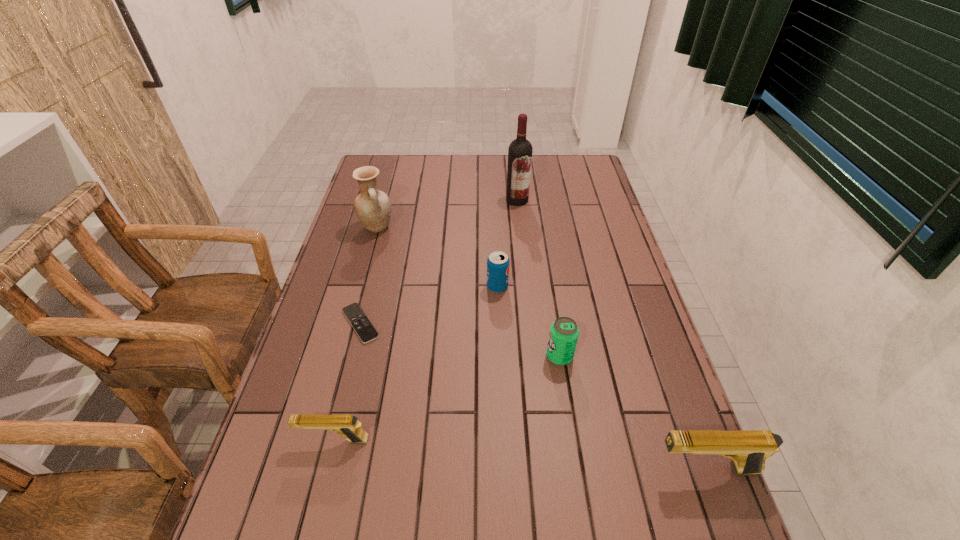
The image size is (960, 540). I want to click on object present at the near right corner, so pyautogui.click(x=749, y=449).

Where is `blank space at the far edge of the desktop`? The width and height of the screenshot is (960, 540). blank space at the far edge of the desktop is located at coordinates (544, 154).

I want to click on free space at the near edge of the desktop, so click(x=490, y=513).

Image resolution: width=960 pixels, height=540 pixels. Find the location of `vacant region at the left edge of the desktop`. vacant region at the left edge of the desktop is located at coordinates [x=308, y=354].

Image resolution: width=960 pixels, height=540 pixels. I want to click on free space at the right edge of the desktop, so click(590, 210).

At what (x,y) coordinates should I click in order to perform the action: click on free space at the far left corner of the desktop. Please return your answer as a coordinate pair (x, y). This screenshot has width=960, height=540. Looking at the image, I should click on (373, 158).

In the image, there is a desktop. Where is `free space at the far right corner`? Image resolution: width=960 pixels, height=540 pixels. free space at the far right corner is located at coordinates (559, 166).

Where is `free spot between the wine bottle and the shortest object`? free spot between the wine bottle and the shortest object is located at coordinates (439, 262).

Where is `vacant space that's between the fourth farthest object and the nearer soda can`? The width and height of the screenshot is (960, 540). vacant space that's between the fourth farthest object and the nearer soda can is located at coordinates (460, 340).

You are a GUI agent. You are given a task and a screenshot of the screen. Output one action in this format:
    pyautogui.click(x=<x>, y=<y>)
    Task: Click on the empty space that is in between the shorter pistol and the wine bottle
    This screenshot has width=960, height=540.
    Given the screenshot: What is the action you would take?
    pyautogui.click(x=425, y=320)